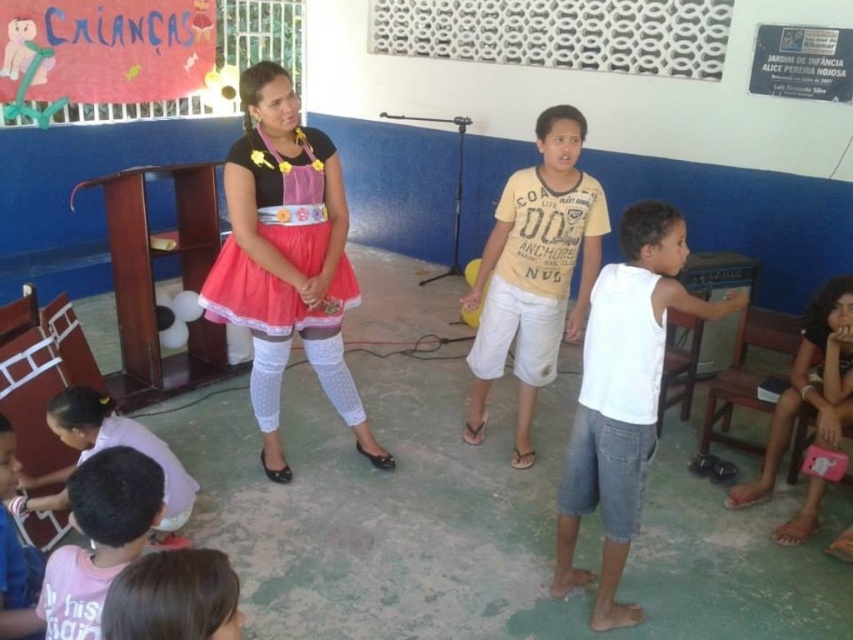
In the scene shown: Can you confirm if white cotton tank top at center is bigger than yellow cotton shirt at center?

Actually, white cotton tank top at center might be smaller than yellow cotton shirt at center.

Is white cotton tank top at center below yellow cotton shirt at center?

Indeed, white cotton tank top at center is positioned under yellow cotton shirt at center.

Image resolution: width=853 pixels, height=640 pixels. I want to click on white cotton tank top at center, so click(622, 397).

Does matte pink dress at center appear on the left side of yellow cotton shirt at center?

Yes, matte pink dress at center is to the left of yellow cotton shirt at center.

Between point (268, 360) and point (518, 292), which one is positioned in front?

Point (268, 360)

Measure the distance between matte pink dress at center and camera.

A distance of 2.53 meters exists between matte pink dress at center and camera.

Locate an element on the screen. Image resolution: width=853 pixels, height=640 pixels. matte pink dress at center is located at coordinates (286, 259).

Does pink fabric shirt at lower left appear on the right side of matte pink purse at lower right?

In fact, pink fabric shirt at lower left is to the left of matte pink purse at lower right.

Is point (97, 493) closer to viewer compared to point (846, 304)?

Yes, point (97, 493) is closer to viewer.

Measure the distance between point (62, 600) and camera.

A distance of 1.57 meters exists between point (62, 600) and camera.

Identify the location of pink fabric shirt at lower left. This screenshot has width=853, height=640. (99, 538).